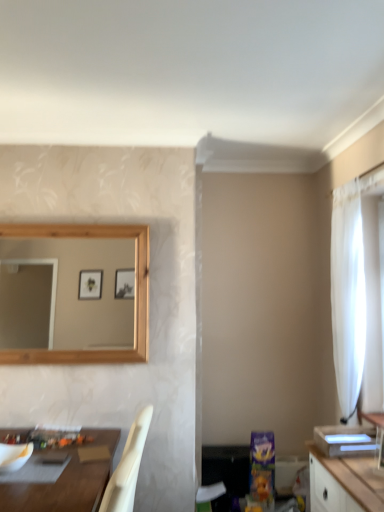
Question: From the image's perspective, is white matte mixing bowl at lower left positioned above or below white glossy vanity at right?

Choices:
 (A) below
 (B) above

Answer: (A)

Question: In terms of size, does white matte mixing bowl at lower left appear bigger or smaller than white glossy vanity at right?

Choices:
 (A) big
 (B) small

Answer: (B)

Question: Which object is the closest to the white sheer curtain at right?

Choices:
 (A) brown wooden table at lower left
 (B) white glossy vanity at right
 (C) white matte mixing bowl at lower left

Answer: (B)

Question: Estimate the real-world distances between objects in this image. Which object is closer to the brown wooden table at lower left?

Choices:
 (A) white glossy vanity at right
 (B) white sheer curtain at right
 (C) white matte mixing bowl at lower left

Answer: (C)